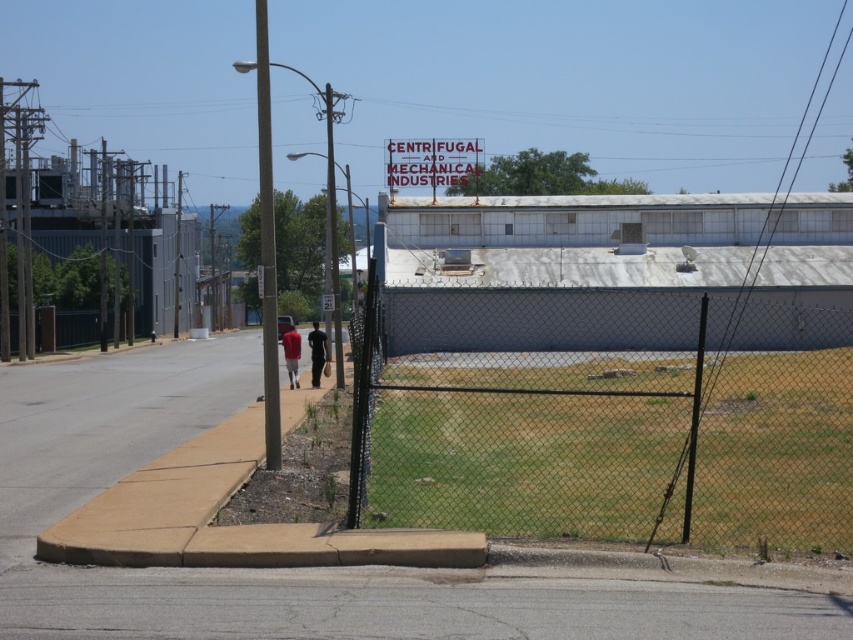
Question: Considering the relative positions of gray asphalt pavement at lower center and black fabric pants at center in the image provided, where is gray asphalt pavement at lower center located with respect to black fabric pants at center?

Choices:
 (A) above
 (B) below

Answer: (B)

Question: Is gray asphalt pavement at lower center thinner than black fabric pants at center?

Choices:
 (A) no
 (B) yes

Answer: (A)

Question: Estimate the real-world distances between objects in this image. Which object is closer to the white plastic sign at center?

Choices:
 (A) chain-link fence at center
 (B) gray asphalt pavement at lower center
 (C) black fabric pants at center
 (D) matte red shirt at center

Answer: (D)

Question: Which point is farther to the camera?

Choices:
 (A) black fabric pants at center
 (B) white plastic sign at center

Answer: (B)

Question: Is gray asphalt pavement at lower center closer to camera compared to matte red shirt at center?

Choices:
 (A) no
 (B) yes

Answer: (B)

Question: Which object is the farthest from the white plastic sign at center?

Choices:
 (A) gray asphalt pavement at lower center
 (B) matte red shirt at center
 (C) chain-link fence at center
 (D) black fabric pants at center

Answer: (A)